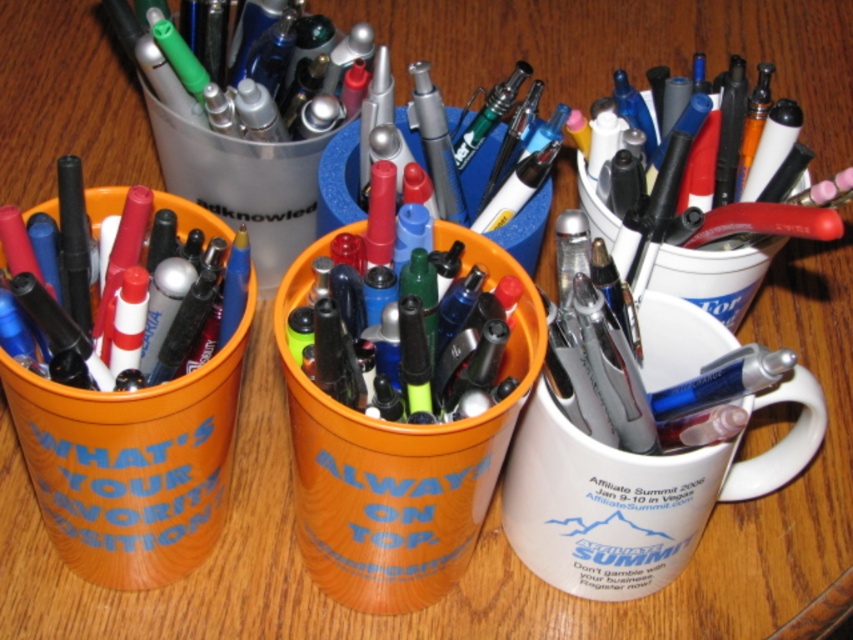
Question: Which object is positioned closest to the metallic silver pen at center?

Choices:
 (A) white matte mug at right
 (B) matte plastic cup at left
 (C) white ceramic mug at right
 (D) metallic silver mug at upper center

Answer: (D)

Question: Is the position of white ceramic mug at right less distant than that of white matte mug at right?

Choices:
 (A) no
 (B) yes

Answer: (B)

Question: Considering the real-world distances, which object is farthest from the metallic silver mug at upper center?

Choices:
 (A) white matte mug at right
 (B) white ceramic mug at right
 (C) matte plastic cup at left
 (D) metallic silver pen at center

Answer: (B)

Question: Estimate the real-world distances between objects in this image. Which object is farther from the matte plastic cup at left?

Choices:
 (A) metallic silver pen at center
 (B) metallic silver mug at upper center
 (C) white ceramic mug at right
 (D) white matte mug at right

Answer: (D)

Question: From the image, what is the correct spatial relationship of metallic silver mug at upper center in relation to metallic silver pen at center?

Choices:
 (A) below
 (B) above

Answer: (A)

Question: Does matte plastic cup at left come behind metallic silver pen at center?

Choices:
 (A) no
 (B) yes

Answer: (A)